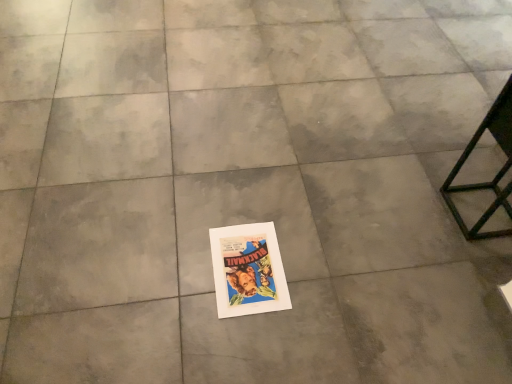
I want to click on empty space that is in between metallic black table at right and vibrant paper poster at center, so click(x=365, y=243).